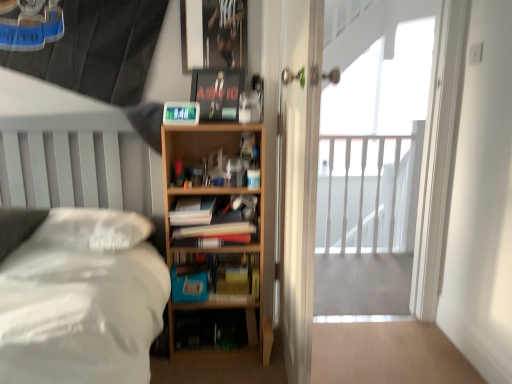
Question: Is white wooden railing at upper right at the left side of white matte bed at left?

Choices:
 (A) no
 (B) yes

Answer: (A)

Question: Is white wooden railing at upper right oriented away from white matte bed at left?

Choices:
 (A) yes
 (B) no

Answer: (B)

Question: From a real-world perspective, is white wooden railing at upper right over white matte bed at left?

Choices:
 (A) yes
 (B) no

Answer: (A)

Question: From the image's perspective, is white wooden railing at upper right over white matte bed at left?

Choices:
 (A) no
 (B) yes

Answer: (B)

Question: Considering the relative sizes of white wooden railing at upper right and white matte bed at left in the image provided, is white wooden railing at upper right wider than white matte bed at left?

Choices:
 (A) yes
 (B) no

Answer: (B)

Question: Which is correct: matte black paperback book at upper center, placed as the first paperback book when sorted from top to bottom, is inside wooden bookcase at center, or outside of it?

Choices:
 (A) inside
 (B) outside

Answer: (B)

Question: Relative to wooden bookcase at center, is matte black paperback book at upper center, placed as the first paperback book when sorted from top to bottom, in front or behind?

Choices:
 (A) behind
 (B) front

Answer: (A)

Question: Does point (202, 97) appear closer or farther from the camera than point (164, 175)?

Choices:
 (A) closer
 (B) farther

Answer: (A)

Question: Considering the positions of matte black paperback book at upper center, placed as the first paperback book when sorted from top to bottom, and wooden bookcase at center in the image, is matte black paperback book at upper center, placed as the first paperback book when sorted from top to bottom, wider or thinner than wooden bookcase at center?

Choices:
 (A) thin
 (B) wide

Answer: (A)

Question: Is point (173, 279) closer or farther from the camera than point (224, 102)?

Choices:
 (A) farther
 (B) closer

Answer: (A)

Question: From the image's perspective, is blue matte paperback book at lower center, which appears as the 2th paperback book when viewed from the top, located above or below matte black paperback book at upper center, the 2th paperback book from the bottom?

Choices:
 (A) below
 (B) above

Answer: (A)

Question: Is blue matte paperback book at lower center, the first paperback book ordered from the bottom, in front of or behind matte black paperback book at upper center, placed as the first paperback book when sorted from top to bottom, in the image?

Choices:
 (A) behind
 (B) front

Answer: (A)

Question: Looking at the image, does blue matte paperback book at lower center, the first paperback book ordered from the bottom, seem bigger or smaller compared to matte black paperback book at upper center, the 2th paperback book from the bottom?

Choices:
 (A) big
 (B) small

Answer: (B)

Question: Would you say blue matte paperback book at lower center, the first paperback book ordered from the bottom, is to the left or to the right of white matte bed at left in the picture?

Choices:
 (A) left
 (B) right

Answer: (B)

Question: Looking at their shapes, would you say blue matte paperback book at lower center, which appears as the 2th paperback book when viewed from the top, is wider or thinner than white matte bed at left?

Choices:
 (A) thin
 (B) wide

Answer: (A)